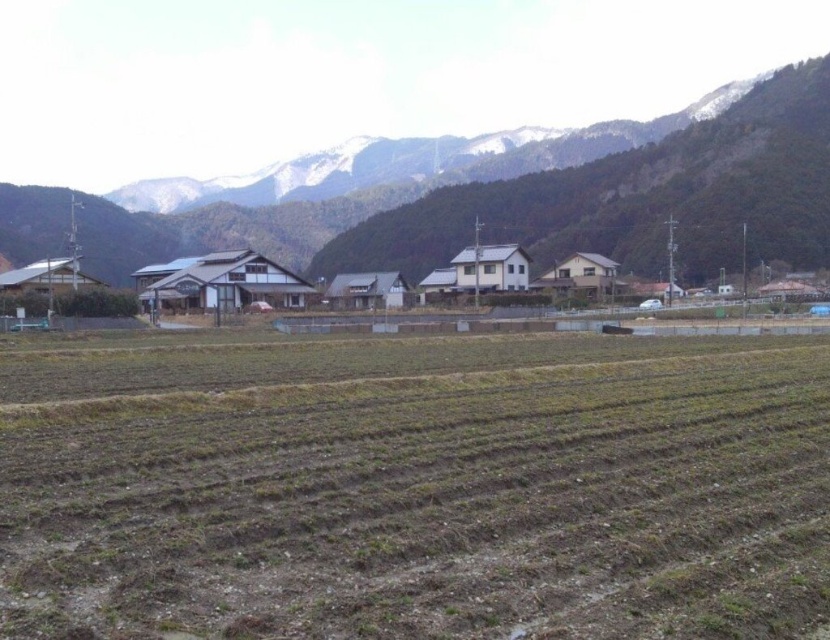
You are standing in the rural landscape and want to walk from the point at coordinates (425, 474) to the point at coordinates (66, 237). Based on the scene description, which direction should you head to reach your destination?

To reach the point at coordinates (66, 237) from the point at coordinates (425, 474), you should head towards the lower left direction since point (425, 474) is in front of point (66, 237).

You are standing at the point marked by the coordinates point (413, 486) in the image. What type of terrain are you currently standing on?

You are standing on the brown soil field at lower center, which is represented by the point (413, 486).